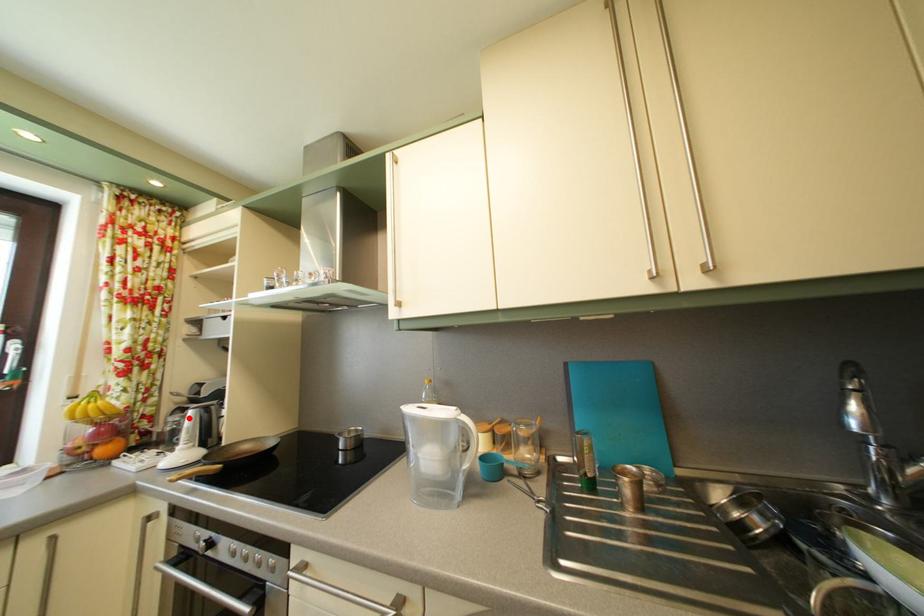
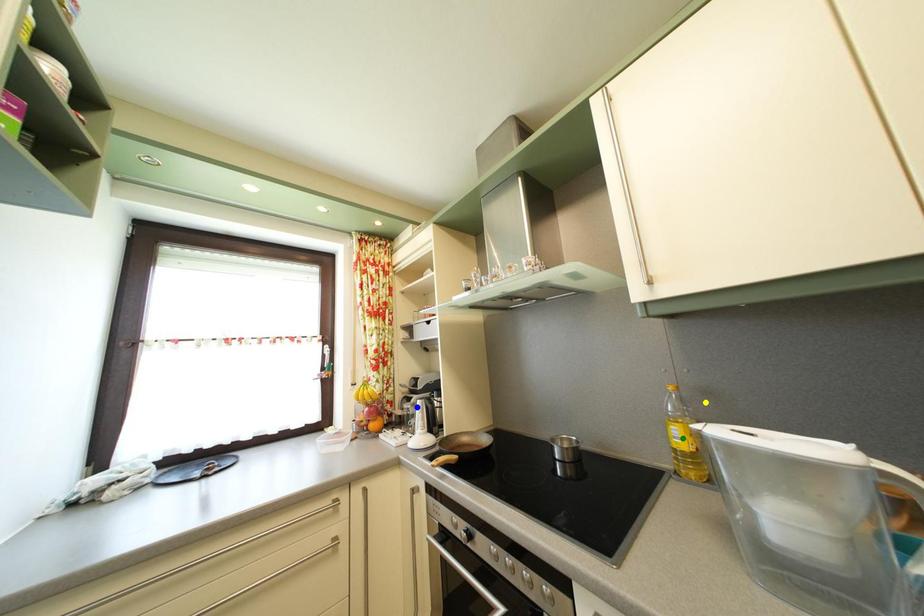
Question: I am providing you with two images of the same scene from different viewpoints. A red point is marked on the first image. You are given multiple points on the second image. Can you choose the point in image 2 that corresponds to the point in image 1?

Choices:
 (A) green point
 (B) blue point
 (C) yellow point

Answer: (B)